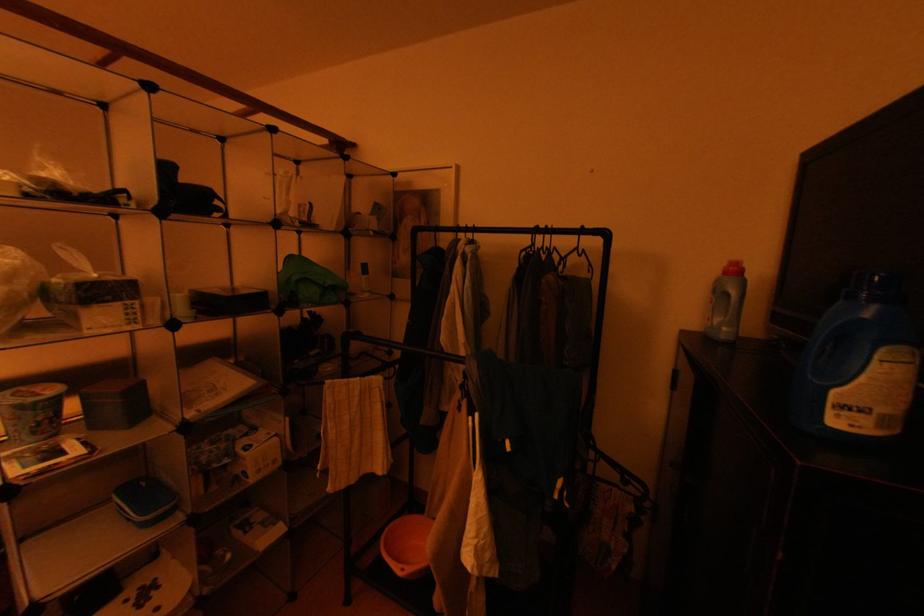
Locate an element on the screen. grey plastic bottle is located at coordinates (857, 365).